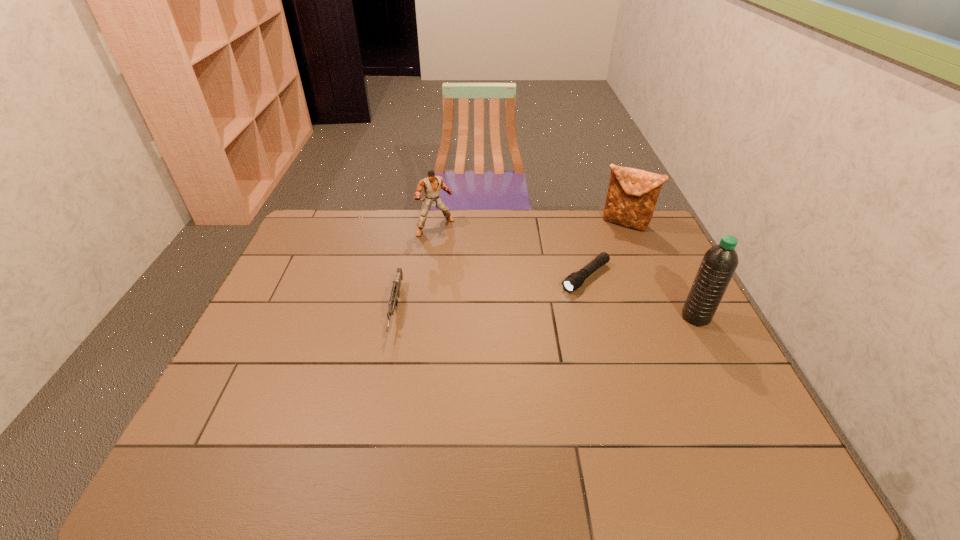
Find the location of `free space on the desktop that is between the leftmost object and the water bottle and is positioned at the lens end of the shortest object`. free space on the desktop that is between the leftmost object and the water bottle and is positioned at the lens end of the shortest object is located at coordinates (540, 313).

Where is `vacant space on the desktop that is between the gun and the tallest object and is positioned on the front-facing side of the fourth object from right to left`? This screenshot has height=540, width=960. vacant space on the desktop that is between the gun and the tallest object and is positioned on the front-facing side of the fourth object from right to left is located at coordinates (505, 312).

This screenshot has width=960, height=540. I want to click on free space on the desktop that is between the leftmost object and the tallest object and is positioned on the open side of the clutch bag, so click(x=557, y=314).